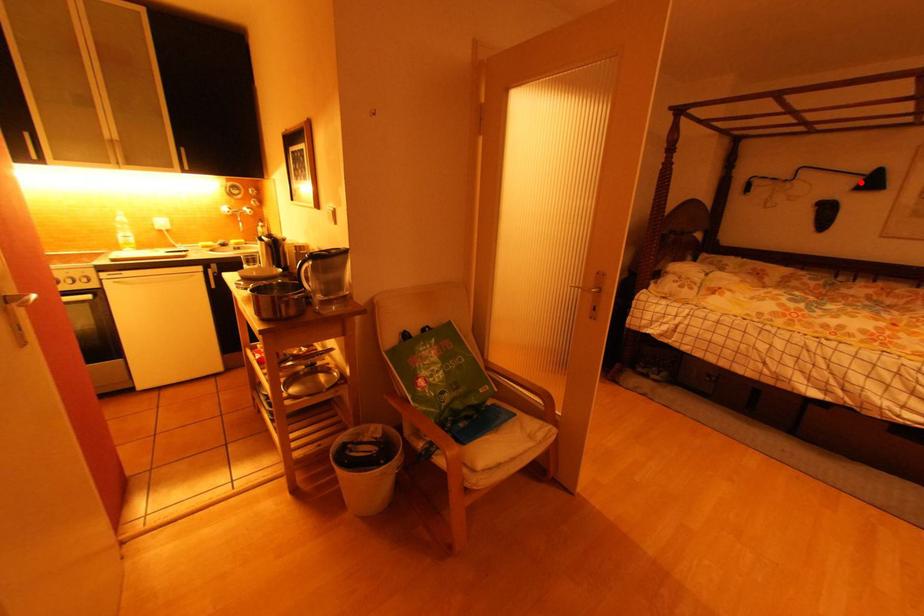
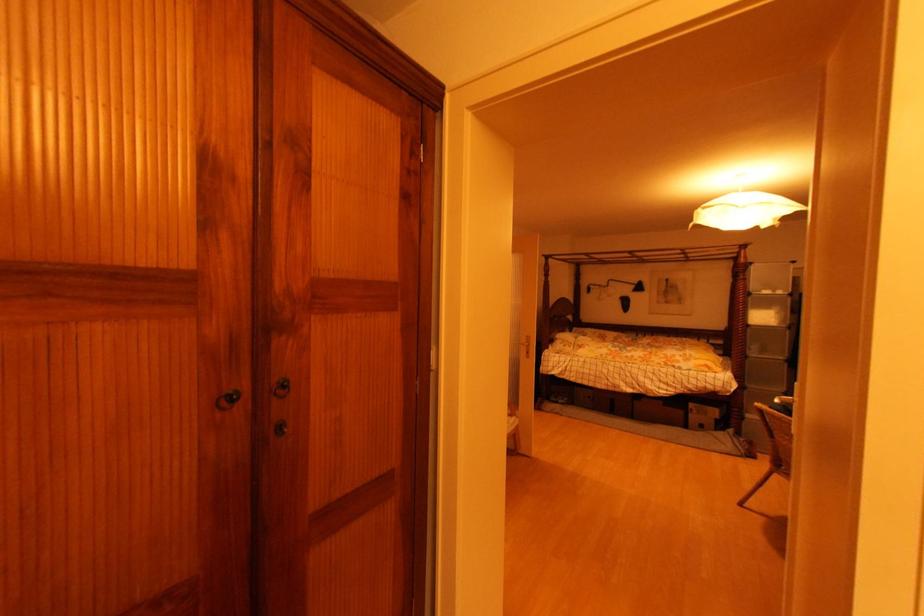
In the second image, find the point that corresponds to the highlighted location in the first image.

(638, 288)